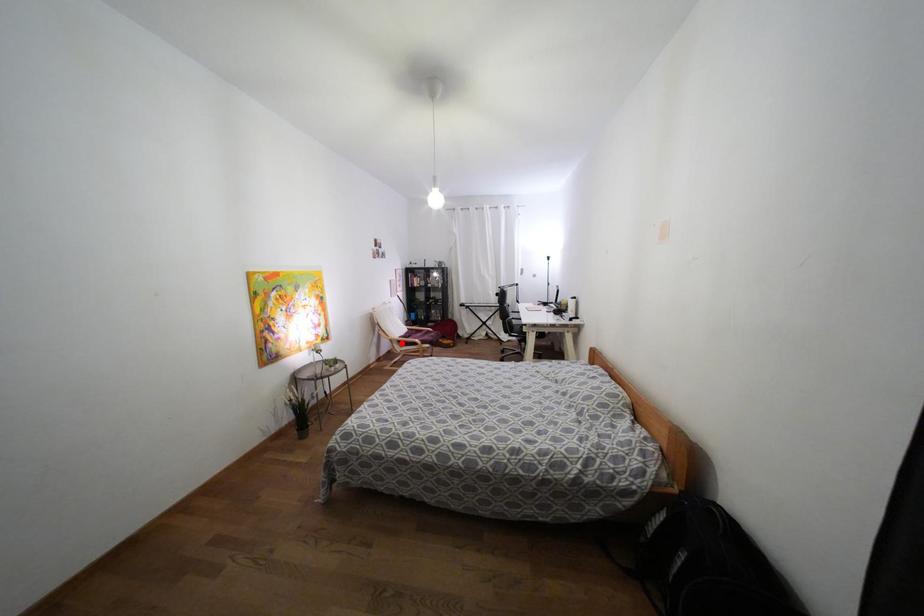
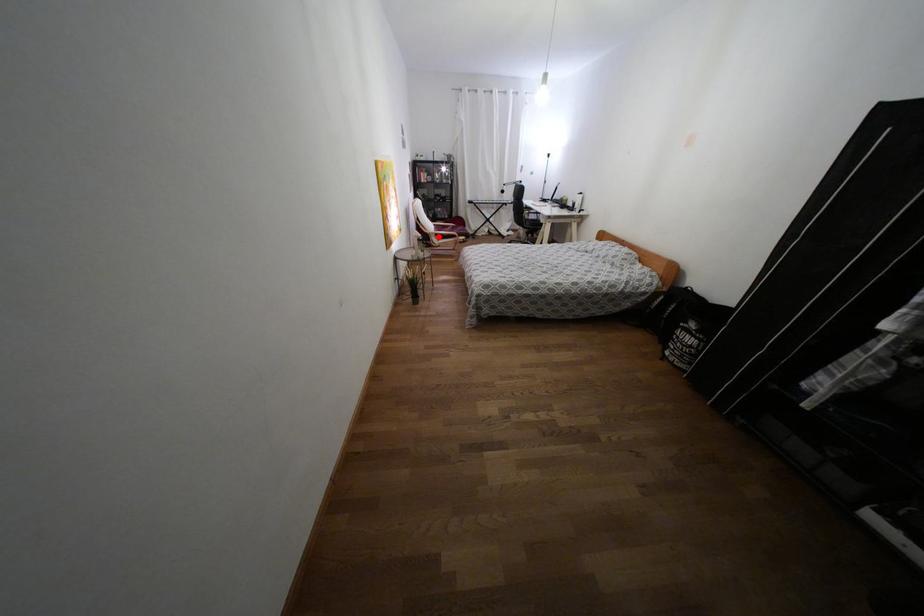
I am providing you with two images of the same scene from different viewpoints. A red point is marked on the first image and another point is marked on the second image. Does the point marked in image1 correspond to the same location as the one in image2?

Yes